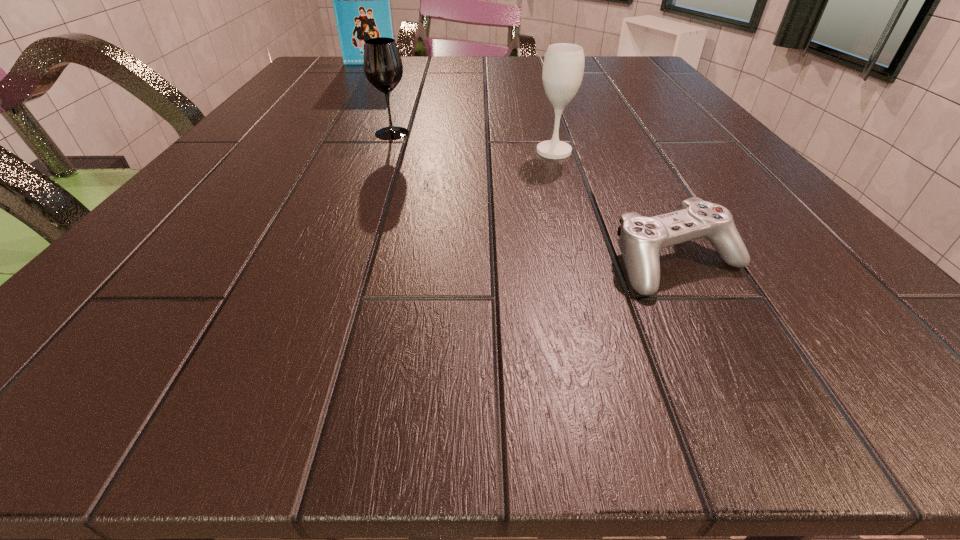
In order to click on vacant space located on the right of the left wineglass in this screenshot , I will do `click(562, 133)`.

At what (x,y) coordinates should I click in order to perform the action: click on free space located on the left of the shortest object. Please return your answer as a coordinate pair (x, y). The height and width of the screenshot is (540, 960). Looking at the image, I should click on (380, 262).

Locate an element on the screen. The width and height of the screenshot is (960, 540). object located at the far edge is located at coordinates (361, 0).

At what (x,y) coordinates should I click in order to perform the action: click on object present at the left edge. Please return your answer as a coordinate pair (x, y). This screenshot has width=960, height=540. Looking at the image, I should click on click(x=361, y=0).

This screenshot has width=960, height=540. Find the location of `object that is positioned at the right edge`. object that is positioned at the right edge is located at coordinates [x=641, y=239].

Find the location of a particular element. object that is at the far left corner is located at coordinates (361, 0).

In the image, there is a desktop. Identify the location of vacant space at the far edge. The width and height of the screenshot is (960, 540). (457, 83).

Where is `vacant space at the near edge of the desktop`? vacant space at the near edge of the desktop is located at coordinates (331, 359).

At what (x,y) coordinates should I click in order to perform the action: click on vacant space at the left edge of the desktop. Please return your answer as a coordinate pair (x, y). This screenshot has height=540, width=960. Looking at the image, I should click on (273, 122).

Locate an element on the screen. This screenshot has height=540, width=960. free space at the right edge of the desktop is located at coordinates (757, 174).